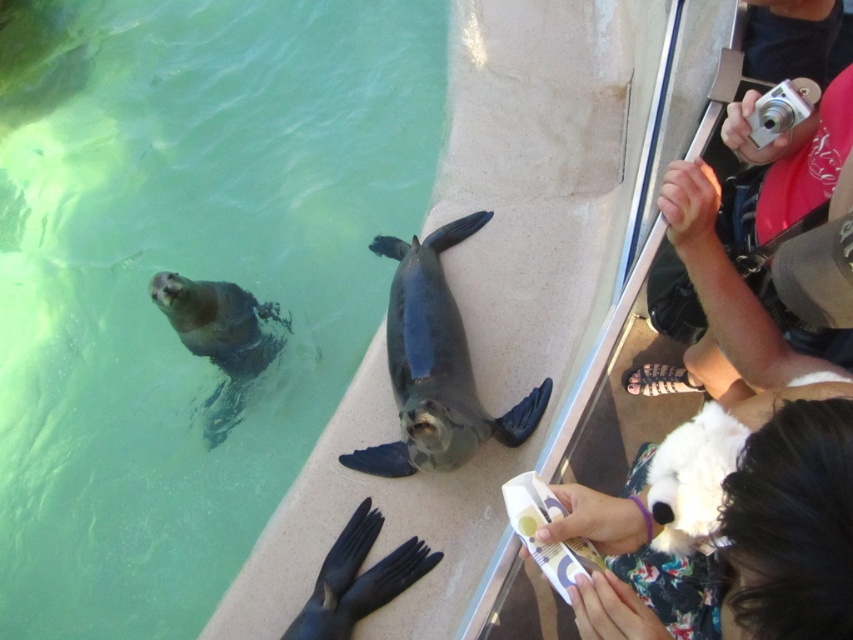
You are a zookeeper preparing to clean the seal exhibit. You need to move the shiny dark gray penguin at center and the gray matte penguin at lower left to a holding area. Which penguin should you move first if you want to start with the one that is closer to the entrance located at the lower right of the exhibit?

The gray matte penguin at lower left is closer to the entrance located at the lower right of the exhibit, so you should move it first.

You are standing in front of the seal exhibit and want to take a photo of both points mentioned. Which point, point (631, 628) or point (323, 637), will appear larger in your photo?

Point (631, 628) will appear larger in the photo because it is closer to the viewer than point (323, 637).